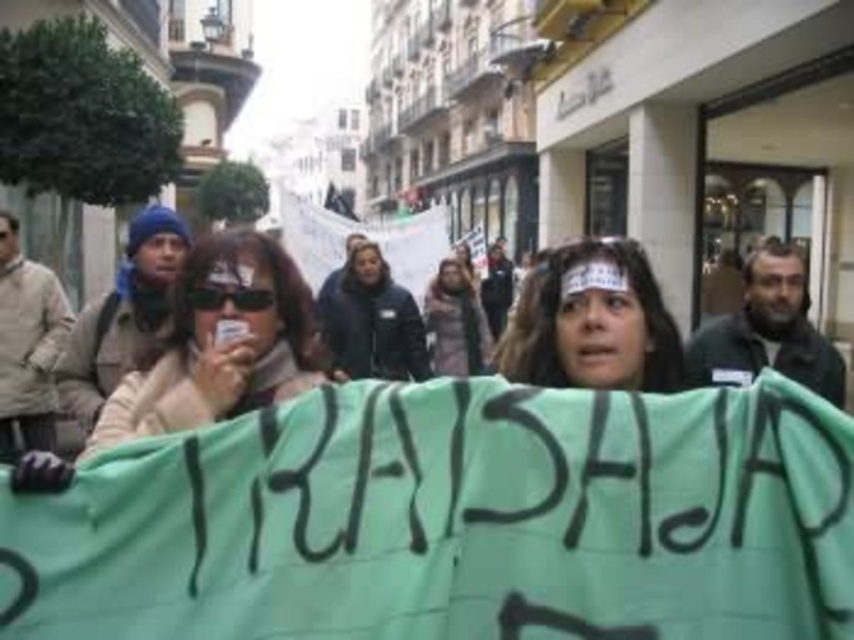
Question: Does green fabric headband at center have a smaller size compared to dark brown leather jacket at center?

Choices:
 (A) no
 (B) yes

Answer: (B)

Question: Which point is closer to the camera?

Choices:
 (A) (648, 380)
 (B) (309, 346)
 (C) (443, 316)

Answer: (A)

Question: Based on their relative distances, which object is farther from the green fabric headband at center?

Choices:
 (A) dark brown leather jacket at center
 (B) matte beige jacket at center

Answer: (A)

Question: Which point appears farthest from the camera in this image?

Choices:
 (A) (186, 416)
 (B) (569, 252)

Answer: (B)

Question: Does matte beige jacket at center have a larger size compared to green fabric headband at center?

Choices:
 (A) yes
 (B) no

Answer: (A)

Question: Is matte beige jacket at center bigger than green fabric headband at center?

Choices:
 (A) no
 (B) yes

Answer: (B)